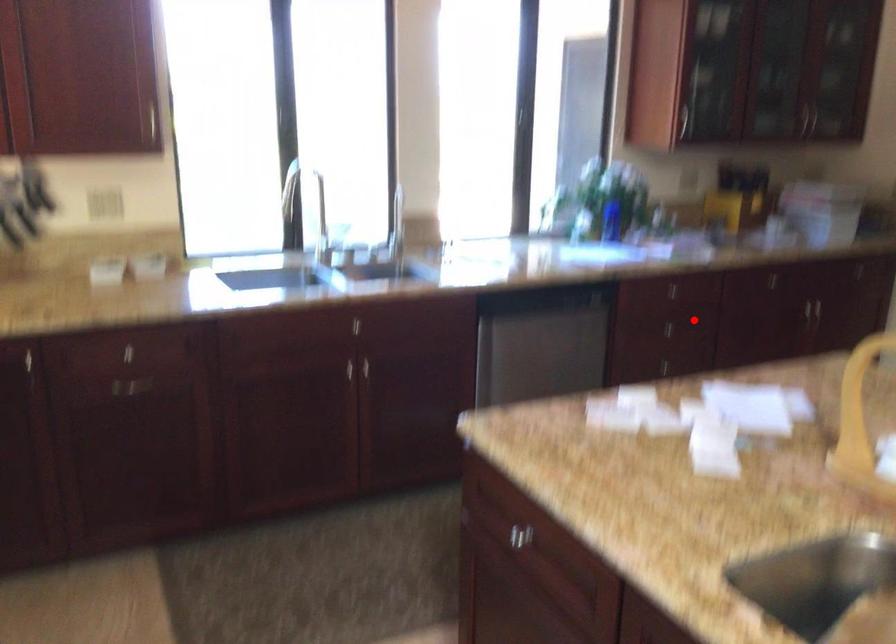
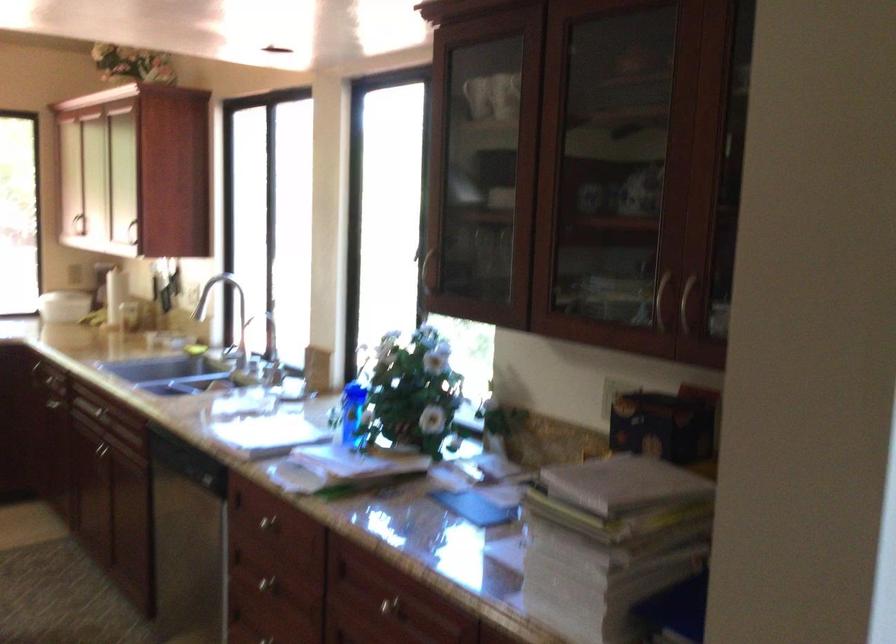
Question: A red point is marked in image1. In image2, is the corresponding 3D point closer to the camera or farther? Reply with the corresponding letter.

Choices:
 (A) The corresponding 3D point is closer.
 (B) The corresponding 3D point is farther.

Answer: (A)